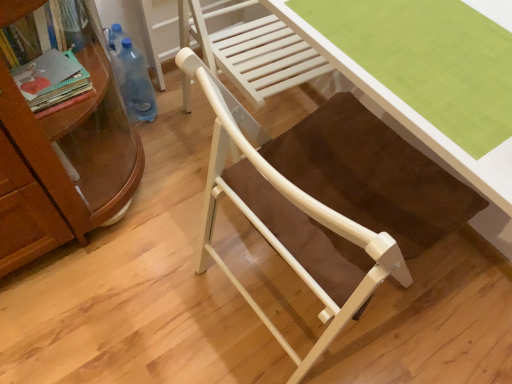
The width and height of the screenshot is (512, 384). In order to click on vacant point to the right of blue plastic bottle at left in this screenshot , I will do `click(185, 120)`.